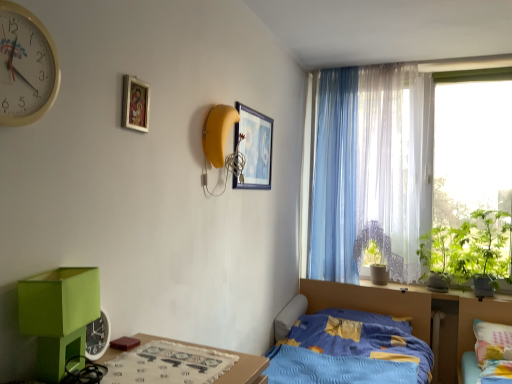
How much space does wooden frame at upper center, positioned as the 1th picture frame in left-to-right order, occupy horizontally?

The width of wooden frame at upper center, positioned as the 1th picture frame in left-to-right order, is 3.48 centimeters.

What do you see at coordinates (370, 170) in the screenshot?
I see `translucent blue curtain at right, the first curtain when ordered from right to left` at bounding box center [370, 170].

Based on the photo, measure the distance between point (362, 98) and camera.

They are 10.64 feet apart.

What do you see at coordinates (373, 254) in the screenshot? Image resolution: width=512 pixels, height=384 pixels. I see `green matte plant at window, arranged as the 3th plant when viewed from the right` at bounding box center [373, 254].

The width and height of the screenshot is (512, 384). What do you see at coordinates (254, 148) in the screenshot? I see `wooden picture frame at upper center, the 1th picture frame in the back-to-front sequence` at bounding box center [254, 148].

Find the location of a particular element. wooden frame at upper center, arranged as the second picture frame when viewed from the right is located at coordinates (135, 104).

Visually, is wooden table at lower left positioned to the left or to the right of blue quilted bed at center, the first bed in the left-to-right sequence?

wooden table at lower left is to the left of blue quilted bed at center, the first bed in the left-to-right sequence.

Locate an element on the screen. the 2nd bed below the wooden table at lower left (from the image's perspective) is located at coordinates (352, 341).

Is the surface of wooden table at lower left in direct contact with blue quilted bed at center, the first bed in the left-to-right sequence?

There is a gap between wooden table at lower left and blue quilted bed at center, the first bed in the left-to-right sequence.

In the image, is wooden table at lower left positioned in front of or behind blue quilted bed at center, the first bed in the left-to-right sequence?

Clearly, wooden table at lower left is in front of blue quilted bed at center, the first bed in the left-to-right sequence.

Looking at this image, would you say blue quilted bed at center, the first bed in the left-to-right sequence, contains multicolored fabric bed at lower right, the 1th bed positioned from the right?

No.

Does blue quilted bed at center, the first bed in the left-to-right sequence, lie behind multicolored fabric bed at lower right, the 1th bed positioned from the right?

No, blue quilted bed at center, the first bed in the left-to-right sequence, is closer to the viewer.

Is blue quilted bed at center, the first bed in the left-to-right sequence, at the left side of multicolored fabric bed at lower right, the 1th bed positioned from the right?

Yes, blue quilted bed at center, the first bed in the left-to-right sequence, is to the left of multicolored fabric bed at lower right, the 1th bed positioned from the right.

Can you confirm if blue quilted bed at center, the first bed in the left-to-right sequence, is shorter than multicolored fabric bed at lower right, the 2th bed in the left-to-right sequence?

No, blue quilted bed at center, the first bed in the left-to-right sequence, is not shorter than multicolored fabric bed at lower right, the 2th bed in the left-to-right sequence.

Does wooden frame at upper center, positioned as the 1th picture frame in left-to-right order, appear on the left side of wooden table at lower left?

Yes, wooden frame at upper center, positioned as the 1th picture frame in left-to-right order, is to the left of wooden table at lower left.

Is wooden frame at upper center, positioned as the 1th picture frame in left-to-right order, positioned far away from wooden table at lower left?

No, wooden frame at upper center, positioned as the 1th picture frame in left-to-right order, is not far away from wooden table at lower left.

Who is bigger, wooden frame at upper center, marked as the 1th picture frame in a front-to-back arrangement, or wooden table at lower left?

wooden table at lower left is bigger.

Considering the positions of objects wooden frame at upper center, arranged as the second picture frame when viewed from the right, and wooden table at lower left in the image provided, who is behind, wooden frame at upper center, arranged as the second picture frame when viewed from the right, or wooden table at lower left?

wooden frame at upper center, arranged as the second picture frame when viewed from the right, is behind.

Is wooden table at lower left positioned with its back to multicolored fabric bed at lower right, the 2th bed in the left-to-right sequence?

No, wooden table at lower left's orientation is not away from multicolored fabric bed at lower right, the 2th bed in the left-to-right sequence.

Is wooden table at lower left at the left side of multicolored fabric bed at lower right, the 2th bed in the left-to-right sequence?

Indeed, wooden table at lower left is positioned on the left side of multicolored fabric bed at lower right, the 2th bed in the left-to-right sequence.

Can we say wooden table at lower left lies outside multicolored fabric bed at lower right, the 1th bed positioned from the right?

wooden table at lower left lies outside multicolored fabric bed at lower right, the 1th bed positioned from the right,'s area.

Image resolution: width=512 pixels, height=384 pixels. I want to click on the 1st bed below the wooden table at lower left (from a real-world perspective), so click(486, 348).

From the green matte changing table at lower left, count 1st picture frame to the right and point to it. Please provide its 2D coordinates.

[(135, 104)]

Is point (132, 84) closer to viewer compared to point (62, 360)?

No.

Considering their positions, is wooden frame at upper center, marked as the 1th picture frame in a front-to-back arrangement, located in front of or behind green matte changing table at lower left?

wooden frame at upper center, marked as the 1th picture frame in a front-to-back arrangement, is positioned farther from the viewer than green matte changing table at lower left.

From a real-world perspective, is wooden frame at upper center, arranged as the second picture frame when viewed from the right, positioned above or below green matte changing table at lower left?

wooden frame at upper center, arranged as the second picture frame when viewed from the right, is above green matte changing table at lower left.

In the scene shown: Is multicolored fabric bed at lower right, the 2th bed in the left-to-right sequence, closer to camera compared to yellow plastic clock at upper left?

No, it is behind yellow plastic clock at upper left.

From a real-world perspective, which object stands above the other?

yellow plastic clock at upper left, from a real-world perspective.

Who is bigger, multicolored fabric bed at lower right, the 2th bed in the left-to-right sequence, or yellow plastic clock at upper left?

multicolored fabric bed at lower right, the 2th bed in the left-to-right sequence, is bigger.

Based on the photo, considering the sizes of multicolored fabric bed at lower right, the 1th bed positioned from the right, and yellow plastic clock at upper left in the image, is multicolored fabric bed at lower right, the 1th bed positioned from the right, wider or thinner than yellow plastic clock at upper left?

In the image, multicolored fabric bed at lower right, the 1th bed positioned from the right, appears to be wider than yellow plastic clock at upper left.

Is green matte changing table at lower left a part of yellow plastic clock at upper left?

No.

From a real-world perspective, is yellow plastic clock at upper left physically below green matte changing table at lower left?

Incorrect, from a real-world perspective, yellow plastic clock at upper left is higher than green matte changing table at lower left.

Locate an element on the screen. The width and height of the screenshot is (512, 384). table located above the blue quilted bed at center, the first bed in the left-to-right sequence (from a real-world perspective) is located at coordinates (232, 366).

Where is `bed lying above the blue quilted bed at center, positioned as the 2th bed in right-to-left order (from the image's perspective)`? bed lying above the blue quilted bed at center, positioned as the 2th bed in right-to-left order (from the image's perspective) is located at coordinates click(486, 348).

From the image, which object appears to be farther from translucent blue curtain at right, which ranks as the second curtain in left-to-right order, wooden table at lower left or blue quilted bed at center, the first bed in the left-to-right sequence?

wooden table at lower left is positioned further to the anchor translucent blue curtain at right, which ranks as the second curtain in left-to-right order.

Estimate the real-world distances between objects in this image. Which object is closer to yellow plastic clock at upper left, green leafy plant at window, the 3th plant when ordered from left to right, or light blue sheer curtain at center, positioned as the 1th curtain in left-to-right order?

light blue sheer curtain at center, positioned as the 1th curtain in left-to-right order, lies closer to yellow plastic clock at upper left than the other object.

Estimate the real-world distances between objects in this image. Which object is further from light blue sheer curtain at center, positioned as the 1th curtain in left-to-right order, yellow plastic clock at upper left or green matte plant at window, arranged as the 3th plant when viewed from the right?

The object further to light blue sheer curtain at center, positioned as the 1th curtain in left-to-right order, is yellow plastic clock at upper left.

Which object lies nearer to the anchor point blue quilted bed at center, positioned as the 2th bed in right-to-left order, wooden picture frame at upper center, which appears as the 1th picture frame when viewed from the right, or light blue sheer curtain at center, positioned as the 1th curtain in left-to-right order?

The object closer to blue quilted bed at center, positioned as the 2th bed in right-to-left order, is light blue sheer curtain at center, positioned as the 1th curtain in left-to-right order.

When comparing their distances from blue quilted bed at center, the first bed in the left-to-right sequence, does translucent blue curtain at right, the first curtain when ordered from right to left, or green matte changing table at lower left seem closer?

translucent blue curtain at right, the first curtain when ordered from right to left, lies closer to blue quilted bed at center, the first bed in the left-to-right sequence, than the other object.

In the scene shown: Which object lies nearer to the anchor point light blue sheer curtain at center, the 2th curtain from the right, translucent blue curtain at right, the first curtain when ordered from right to left, or blue quilted bed at center, positioned as the 2th bed in right-to-left order?

The object closer to light blue sheer curtain at center, the 2th curtain from the right, is translucent blue curtain at right, the first curtain when ordered from right to left.

From the image, which object appears to be farther from green leafy plant at window, the 2th plant in the right-to-left sequence, wooden frame at upper center, arranged as the second picture frame when viewed from the right, or green leafy plant at window, the 3th plant when ordered from left to right?

wooden frame at upper center, arranged as the second picture frame when viewed from the right.

In the scene shown: Which object lies nearer to the anchor point green matte plant at window, arranged as the 3th plant when viewed from the right, green matte changing table at lower left or wooden picture frame at upper center, positioned as the 2th picture frame in front-to-back order?

wooden picture frame at upper center, positioned as the 2th picture frame in front-to-back order, is closer to green matte plant at window, arranged as the 3th plant when viewed from the right.

Locate an element on the screen. The width and height of the screenshot is (512, 384). table situated between green matte changing table at lower left and multicolored fabric bed at lower right, the 1th bed positioned from the right, from left to right is located at coordinates (232, 366).

Find the location of a particular element. picture frame between wooden frame at upper center, arranged as the second picture frame when viewed from the right, and green leafy plant at window, the 2th plant in the right-to-left sequence is located at coordinates (254, 148).

In order to click on table positioned between yellow plastic clock at upper left and light blue sheer curtain at center, positioned as the 1th curtain in left-to-right order, from near to far in this screenshot , I will do `click(232, 366)`.

Where is `picture frame between wooden frame at upper center, arranged as the second picture frame when viewed from the right, and green matte plant at window, arranged as the 3th plant when viewed from the right, along the z-axis`? This screenshot has width=512, height=384. picture frame between wooden frame at upper center, arranged as the second picture frame when viewed from the right, and green matte plant at window, arranged as the 3th plant when viewed from the right, along the z-axis is located at coordinates (254, 148).